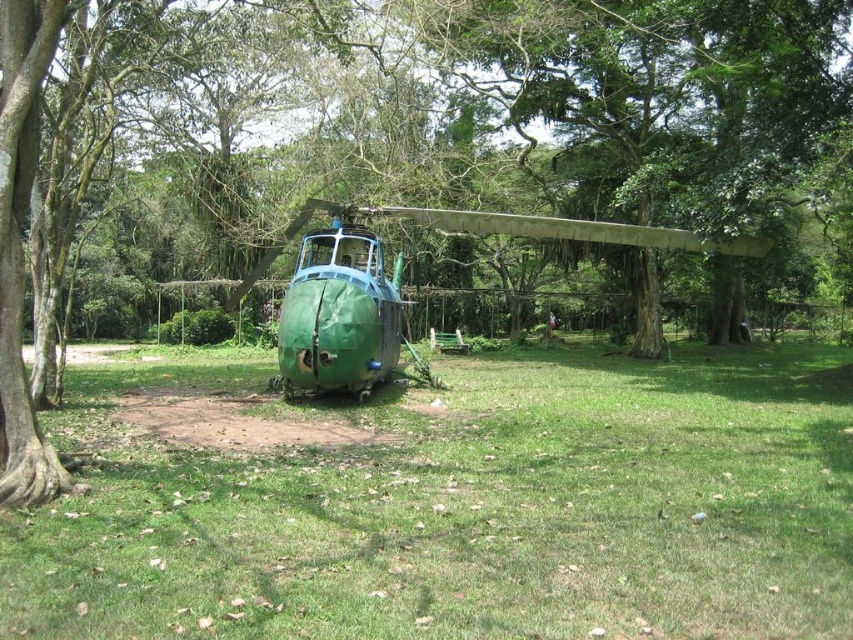
Does green grass at center have a larger size compared to green matte helicopter at center?

Incorrect, green grass at center is not larger than green matte helicopter at center.

What do you see at coordinates (445, 500) in the screenshot?
I see `green grass at center` at bounding box center [445, 500].

Describe the element at coordinates (445, 500) in the screenshot. I see `green grass at center` at that location.

This screenshot has width=853, height=640. Identify the location of green grass at center. (445, 500).